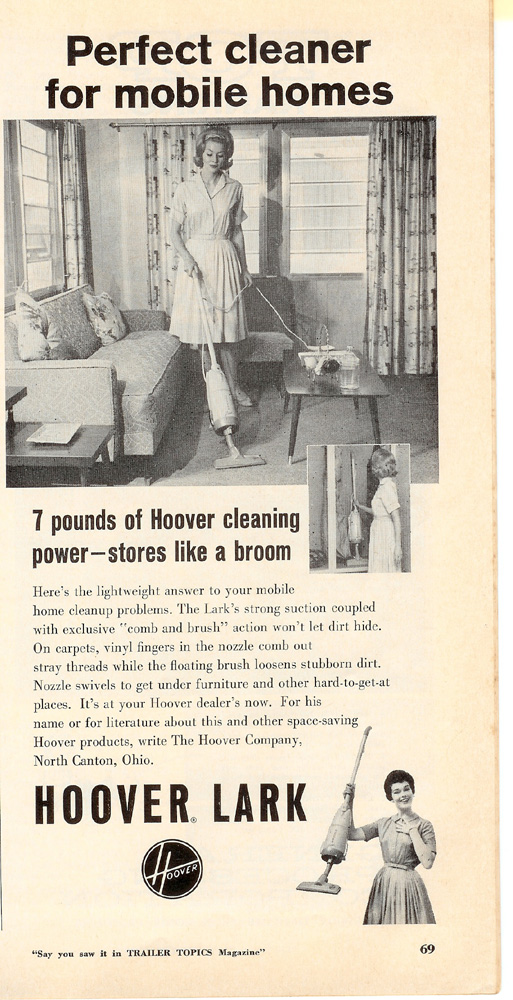
You are a GUI agent. You are given a task and a screenshot of the screen. Output one action in this format:
    pyautogui.click(x=<x>, y=<y>)
    Task: Click on the couch
    This screenshot has width=513, height=1000.
    Given the screenshot: What is the action you would take?
    pyautogui.click(x=146, y=360)